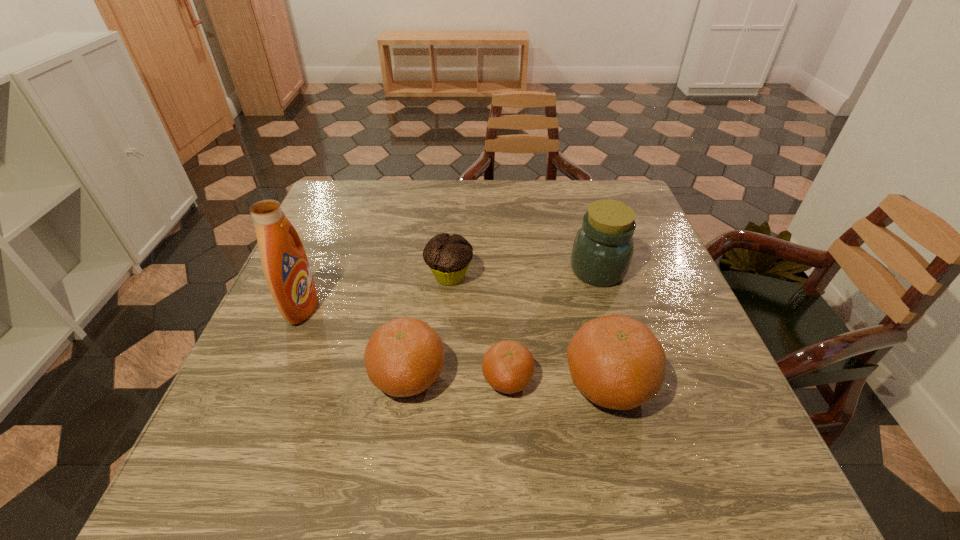
Where is `free spot located 0.080m on the back of the rightmost clementine`? The image size is (960, 540). free spot located 0.080m on the back of the rightmost clementine is located at coordinates (592, 319).

Locate an element on the screen. This screenshot has width=960, height=540. free space located 0.090m on the front-facing side of the tallest object is located at coordinates (355, 307).

This screenshot has height=540, width=960. I want to click on free spot located 0.240m on the left of the muffin, so 327,276.

The height and width of the screenshot is (540, 960). I want to click on vacant area situated 0.110m on the right of the jar, so tap(670, 271).

Find the location of a particular element. This screenshot has width=960, height=540. object located at the left edge is located at coordinates (285, 265).

Where is `clementine that is positioned at the right edge`? Image resolution: width=960 pixels, height=540 pixels. clementine that is positioned at the right edge is located at coordinates (615, 361).

You are a GUI agent. You are given a task and a screenshot of the screen. Output one action in this format:
    pyautogui.click(x=<x>, y=<y>)
    Task: Click on the jar at the right edge
    Image resolution: width=960 pixels, height=540 pixels.
    Given the screenshot: What is the action you would take?
    pyautogui.click(x=602, y=251)

At what (x,y) coordinates should I click in order to perform the action: click on object positioned at the near right corner. Please return your answer as a coordinate pair (x, y). Looking at the image, I should click on (615, 361).

In order to click on vacant space at the far edge in this screenshot , I will do `click(558, 211)`.

This screenshot has height=540, width=960. In the image, there is a desktop. In order to click on free space at the left edge in this screenshot , I will do `click(327, 304)`.